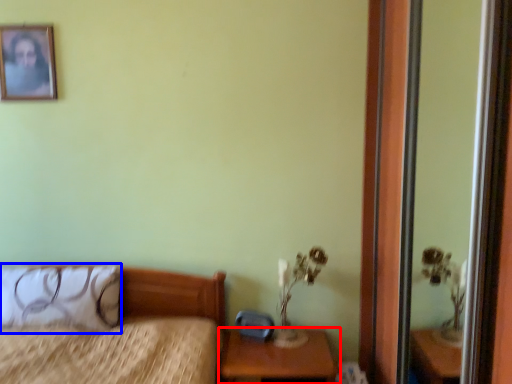
Question: Which point is further to the camera, nightstand (highlighted by a red box) or pillow (highlighted by a blue box)?

Choices:
 (A) nightstand
 (B) pillow

Answer: (B)